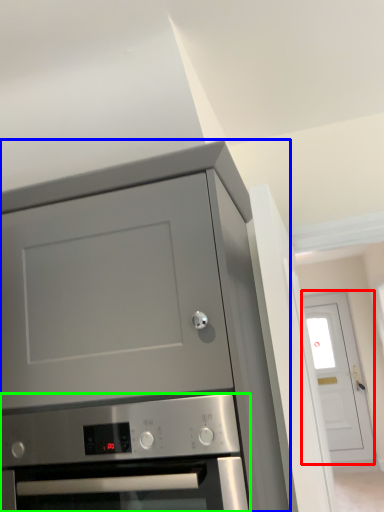
Question: Based on their relative distances, which object is farther from door (highlighted by a red box)? Choose from cabinetry (highlighted by a blue box) and oven (highlighted by a green box).

Choices:
 (A) cabinetry
 (B) oven

Answer: (B)